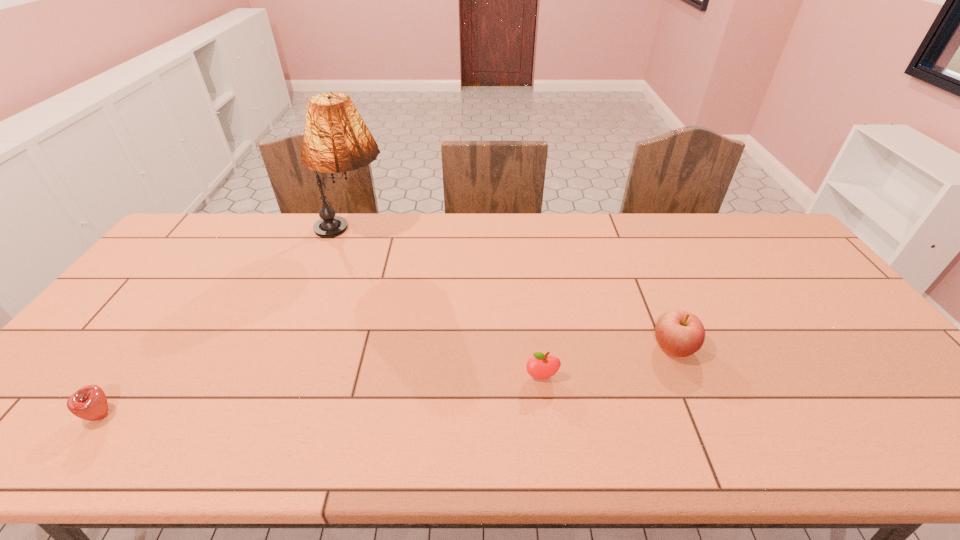
You are a GUI agent. You are given a task and a screenshot of the screen. Output one action in this format:
    pyautogui.click(x=<x>, y=<y>)
    Task: Click on the third object from right to left
    
    Given the screenshot: What is the action you would take?
    pyautogui.click(x=336, y=139)

Locate an element on the screen. This screenshot has width=960, height=540. the farthest object is located at coordinates (336, 139).

Where is `the tallest apple`? The width and height of the screenshot is (960, 540). the tallest apple is located at coordinates (679, 333).

Where is `the third nearest object`? This screenshot has height=540, width=960. the third nearest object is located at coordinates (679, 333).

At what (x,y) coordinates should I click in order to perform the action: click on the second object from right to left. Please return your answer as a coordinate pair (x, y). The width and height of the screenshot is (960, 540). Looking at the image, I should click on (541, 366).

Identify the location of the second farthest apple. This screenshot has width=960, height=540. (541, 366).

Locate an element on the screen. the nearest apple is located at coordinates (90, 403).

Where is `the nearest object`? This screenshot has width=960, height=540. the nearest object is located at coordinates 90,403.

Find the location of a particular element. vacant space located on the front-facing side of the tallest object is located at coordinates (409, 233).

Where is `vacant area situated 0.270m on the right of the farthest apple`? vacant area situated 0.270m on the right of the farthest apple is located at coordinates (800, 348).